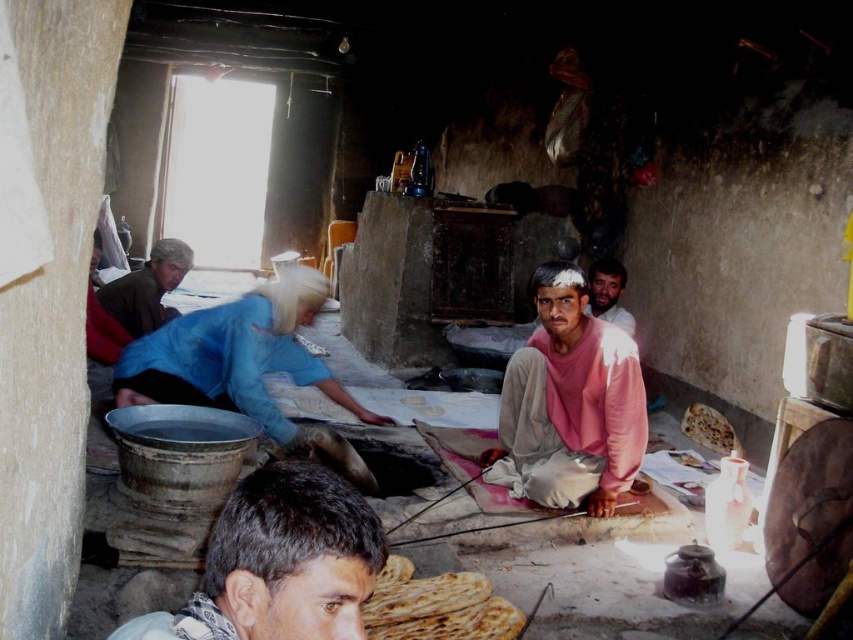
Is pink matte sweater at center wider than blue fabric at left?

Yes, pink matte sweater at center is wider than blue fabric at left.

Does pink matte sweater at center lie in front of blue fabric at left?

Yes, pink matte sweater at center is closer to the viewer.

Between point (543, 307) and point (143, 308), which one is positioned in front?

Point (543, 307) is more forward.

At what (x,y) coordinates should I click in order to perform the action: click on pink matte sweater at center. Please return your answer as a coordinate pair (x, y). The height and width of the screenshot is (640, 853). Looking at the image, I should click on (569, 403).

Based on the photo, which is below, pink matte sweater at center or light pink fabric at center?

Positioned lower is pink matte sweater at center.

Which is in front, point (485, 480) or point (608, 269)?

Point (485, 480) is more forward.

Is point (527, 340) positioned before point (608, 269)?

Yes.

Find the location of a particular element. This screenshot has height=640, width=853. pink matte sweater at center is located at coordinates (569, 403).

Is dark brown hair at lower center bigger than blue fabric at left?

No.

Between point (292, 625) and point (166, 257), which one is positioned behind?

Point (166, 257)

Is point (241, 534) positioned after point (120, 292)?

That is False.

At what (x,y) coordinates should I click in order to perform the action: click on dark brown hair at lower center. Please return your answer as a coordinate pair (x, y). Image resolution: width=853 pixels, height=640 pixels. Looking at the image, I should click on (280, 563).